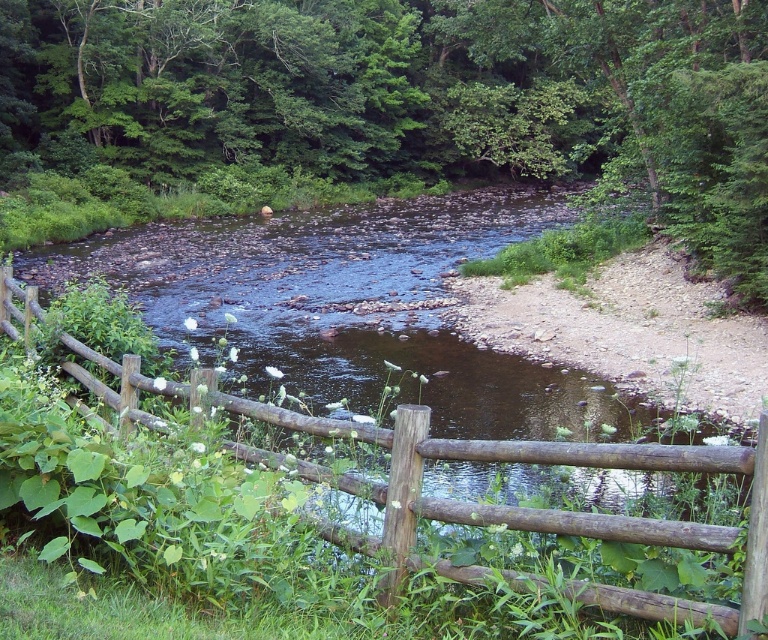
You are a painter standing at the edge of the stream and want to capture the green leafy tree at center and brown wooden fence at center in your painting. Which object is wider in the scene?

The green leafy tree at center is wider than the brown wooden fence at center.

You are a hiker who wants to cross the stream. The green leafy tree at center and the brown wooden fence at center are both visible from your current position. How far apart are these two landmarks?

The green leafy tree at center and the brown wooden fence at center are 58.16 meters apart.

You are standing in the middle of the stream and want to reach the green leafy tree at center and the brown wooden fence at center. Which one is closer to you?

The green leafy tree at center is closer to you because it is positioned further to the viewer than the brown wooden fence at center, meaning it is nearer in your line of sight.